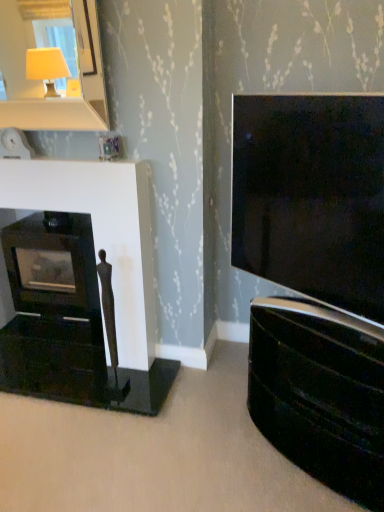
Question: In terms of width, does white glossy mirror at upper left look wider or thinner when compared to matte black fireplace at left?

Choices:
 (A) thin
 (B) wide

Answer: (B)

Question: Is white glossy mirror at upper left inside or outside of matte black fireplace at left?

Choices:
 (A) inside
 (B) outside

Answer: (B)

Question: Which object is positioned farthest from the glossy black tv cabinet at right?

Choices:
 (A) white glossy mirror at upper left
 (B) matte black fireplace at left
 (C) matte black tv at right

Answer: (A)

Question: Which object is the farthest from the matte black fireplace at left?

Choices:
 (A) matte black tv at right
 (B) glossy black tv cabinet at right
 (C) white glossy mirror at upper left

Answer: (C)